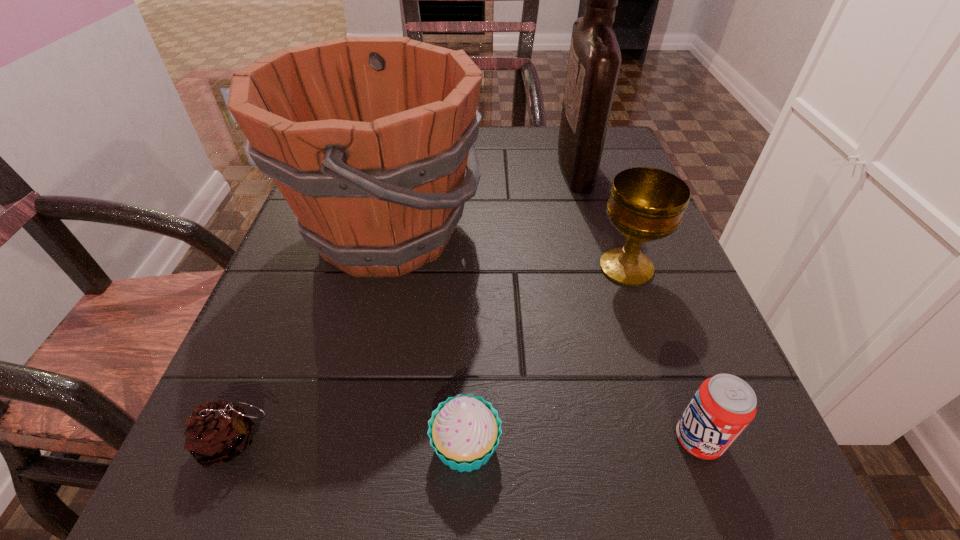
At what (x,y) coordinates should I click in order to perform the action: click on bucket present at the left edge. Please return your answer as a coordinate pair (x, y). Looking at the image, I should click on (368, 138).

In order to click on pinecone that is at the left edge in this screenshot , I will do `click(217, 432)`.

You are a GUI agent. You are given a task and a screenshot of the screen. Output one action in this format:
    pyautogui.click(x=<x>, y=<y>)
    Task: Click on the liquor located at the right edge
    
    Given the screenshot: What is the action you would take?
    pyautogui.click(x=594, y=62)

Where is `chalice located at the right edge`? Image resolution: width=960 pixels, height=540 pixels. chalice located at the right edge is located at coordinates (646, 204).

Locate an element on the screen. This screenshot has width=960, height=540. soda can present at the right edge is located at coordinates (723, 406).

Locate an element on the screen. Image resolution: width=960 pixels, height=540 pixels. object located at the far left corner is located at coordinates (368, 138).

Find the location of a particular element. Image resolution: width=960 pixels, height=540 pixels. object that is positioned at the near left corner is located at coordinates (217, 432).

You are a GUI agent. You are given a task and a screenshot of the screen. Output one action in this format:
    pyautogui.click(x=<x>, y=<y>)
    Task: Click on the object situated at the far right corner
    The width and height of the screenshot is (960, 540).
    Given the screenshot: What is the action you would take?
    pyautogui.click(x=594, y=62)

Locate an element on the screen. This screenshot has height=540, width=960. vacant area at the near edge is located at coordinates (415, 519).

Locate an element on the screen. The width and height of the screenshot is (960, 540). vacant space at the left edge of the desktop is located at coordinates (266, 447).